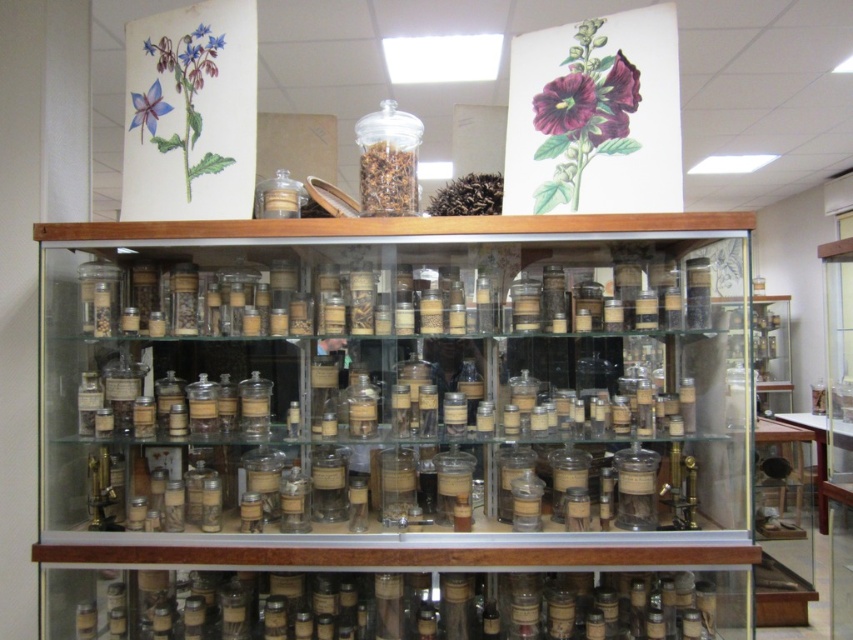
You are a botanist who needs to store a new specimen in one of the jars. The specimen requires a wider jar to accommodate its size. Which jar should you choose between the clear glass jars at center and the transparent glass jar at center?

The clear glass jars at center might be wider than transparent glass jar at center, so you should choose the clear glass jars at center to store the new specimen.

You are a botanist who needs to store a tall dried sunflower specimen. You see the clear glass jars at center and the transparent glass jar at center. Which jar would be more suitable for the specimen based on their heights?

The clear glass jars at center has a greater height compared to the transparent glass jar at center, so the clear glass jars at center would be more suitable for storing the tall dried sunflower specimen.